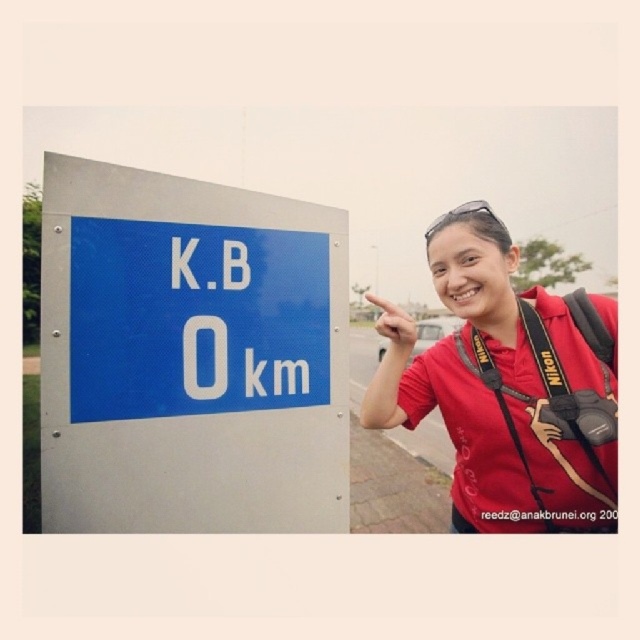
You are a hiker who wants to take a photo of the blue glossy sign at left. You are standing at point (189, 355). Is the blue glossy sign at left in your camera frame?

The point (189, 355) is where the blue glossy sign at left is located, so yes, the blue glossy sign at left is in your camera frame since you are standing at that exact point.

You are a delivery driver who needs to place a rectangular box between the blue glossy sign at left and the matte red shirt at center. The box is 20 inches long. Will it fit between them?

The distance between the blue glossy sign at left and the matte red shirt at center is 19.66 inches. Since the box is 20 inches long, it will not fit between them as the space is slightly shorter than the box.

You are a photographer trying to adjust your camera settings. You notice the matte red shirt at center and the clear plastic goggles at upper center. Which object is nearer to you, the photographer, when focusing your camera lens?

The matte red shirt at center is closer to the viewer than the clear plastic goggles at upper center, so the matte red shirt at center would be the nearer object when focusing your camera lens.